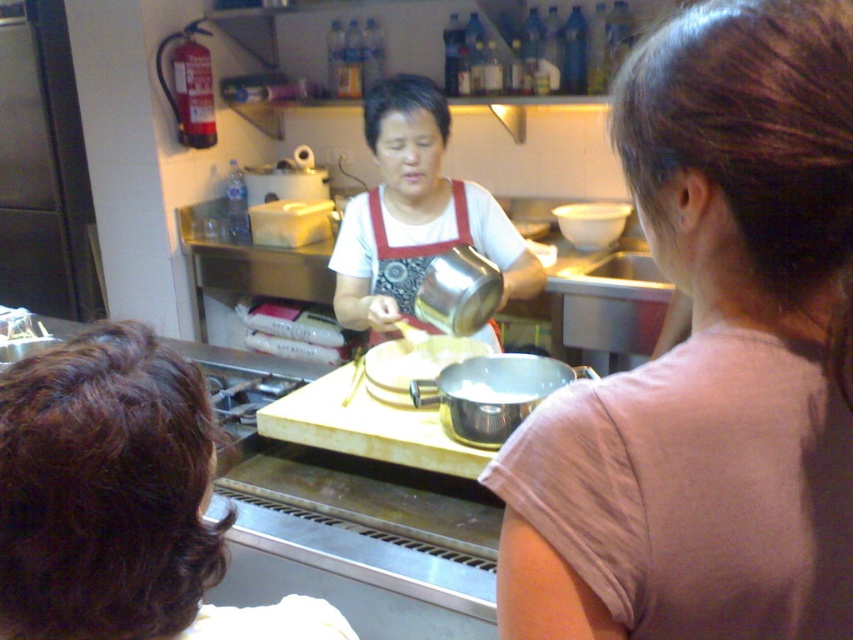
Question: Can you confirm if matte white apron at center is wider than brown curly hair at lower left?

Choices:
 (A) yes
 (B) no

Answer: (B)

Question: Is matte white apron at center smaller than brown curly hair at lower left?

Choices:
 (A) no
 (B) yes

Answer: (A)

Question: Which point appears farthest from the camera in this image?

Choices:
 (A) (779, 464)
 (B) (248, 627)

Answer: (B)

Question: Is matte white apron at center wider than brown curly hair at lower left?

Choices:
 (A) yes
 (B) no

Answer: (B)